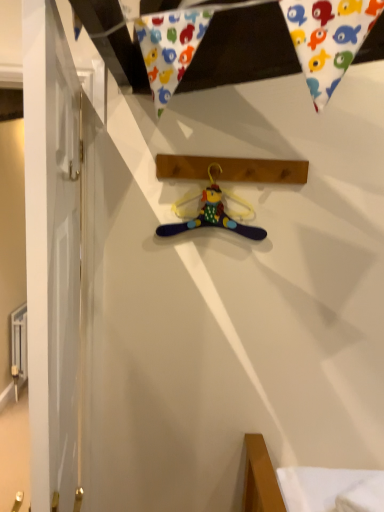
Question: From a real-world perspective, is purple fabric hanger at center positioned above or below brown wooden plank at center?

Choices:
 (A) above
 (B) below

Answer: (B)

Question: In terms of width, does purple fabric hanger at center look wider or thinner when compared to brown wooden plank at center?

Choices:
 (A) thin
 (B) wide

Answer: (A)

Question: Do you think purple fabric hanger at center is within brown wooden plank at center, or outside of it?

Choices:
 (A) outside
 (B) inside

Answer: (A)

Question: Considering the positions of point (266, 169) and point (215, 167), is point (266, 169) closer or farther from the camera than point (215, 167)?

Choices:
 (A) farther
 (B) closer

Answer: (A)

Question: Is brown wooden plank at center bigger or smaller than purple fabric hanger at center?

Choices:
 (A) small
 (B) big

Answer: (B)

Question: From a real-world perspective, relative to purple fabric hanger at center, is brown wooden plank at center vertically above or below?

Choices:
 (A) above
 (B) below

Answer: (A)

Question: In the image, is brown wooden plank at center positioned in front of or behind purple fabric hanger at center?

Choices:
 (A) front
 (B) behind

Answer: (A)